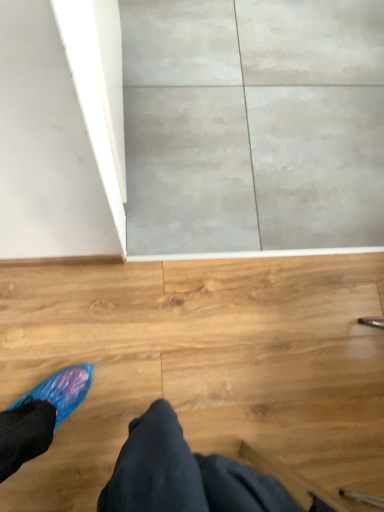
I want to click on blue plastic shoe at lower left, so click(x=191, y=476).

Image resolution: width=384 pixels, height=512 pixels. What do you see at coordinates (191, 476) in the screenshot? I see `blue plastic shoe at lower left` at bounding box center [191, 476].

At what (x,y) coordinates should I click in order to perform the action: click on gray concrete wall at upper center. Please return your answer as a coordinate pair (x, y). The width and height of the screenshot is (384, 512). Looking at the image, I should click on (253, 125).

The height and width of the screenshot is (512, 384). Describe the element at coordinates (253, 125) in the screenshot. I see `gray concrete wall at upper center` at that location.

You are a GUI agent. You are given a task and a screenshot of the screen. Output one action in this format:
    pyautogui.click(x=<x>, y=<y>)
    Task: Click on the blue plastic shoe at lower left
    Image resolution: width=384 pixels, height=512 pixels.
    Given the screenshot: What is the action you would take?
    pyautogui.click(x=191, y=476)

Would you say blue plastic shoe at lower left is to the left or to the right of gray concrete wall at upper center in the picture?

Based on their positions, blue plastic shoe at lower left is located to the left of gray concrete wall at upper center.

Is blue plastic shoe at lower left closer to the viewer compared to gray concrete wall at upper center?

Yes, blue plastic shoe at lower left is closer to the viewer.

Which point is more distant from viewer, (x=7, y=468) or (x=288, y=65)?

The point (x=288, y=65) is behind.

Based on the photo, from the image's perspective, between blue plastic shoe at lower left and gray concrete wall at upper center, which one is located above?

gray concrete wall at upper center, from the image's perspective.

From a real-world perspective, is blue plastic shoe at lower left on top of gray concrete wall at upper center?

Indeed, from a real-world perspective, blue plastic shoe at lower left stands above gray concrete wall at upper center.

Considering the sizes of blue plastic shoe at lower left and gray concrete wall at upper center in the image, is blue plastic shoe at lower left wider or thinner than gray concrete wall at upper center?

blue plastic shoe at lower left is thinner than gray concrete wall at upper center.

Does blue plastic shoe at lower left have a greater height compared to gray concrete wall at upper center?

Correct, blue plastic shoe at lower left is much taller as gray concrete wall at upper center.

Considering the sizes of objects blue plastic shoe at lower left and gray concrete wall at upper center in the image provided, who is bigger, blue plastic shoe at lower left or gray concrete wall at upper center?

Bigger between the two is blue plastic shoe at lower left.

Which is correct: blue plastic shoe at lower left is inside gray concrete wall at upper center, or outside of it?

blue plastic shoe at lower left is spatially situated outside gray concrete wall at upper center.

Consider the image. Would you consider blue plastic shoe at lower left to be distant from gray concrete wall at upper center?

They are positioned close to each other.

Is blue plastic shoe at lower left turned away from gray concrete wall at upper center?

No, blue plastic shoe at lower left's orientation is not away from gray concrete wall at upper center.

This screenshot has height=512, width=384. In order to click on concrete on the right of blue plastic shoe at lower left in this screenshot , I will do `click(253, 125)`.

Does gray concrete wall at upper center appear on the right side of blue plastic shoe at lower left?

Correct, you'll find gray concrete wall at upper center to the right of blue plastic shoe at lower left.

Between gray concrete wall at upper center and blue plastic shoe at lower left, which one is positioned behind?

gray concrete wall at upper center is further from the camera.

Is point (214, 242) less distant than point (167, 425)?

No, it is behind (167, 425).

From the image's perspective, is gray concrete wall at upper center above or below blue plastic shoe at lower left?

Based on their image positions, gray concrete wall at upper center is located above blue plastic shoe at lower left.

Consider the image. From a real-world perspective, is gray concrete wall at upper center located higher than blue plastic shoe at lower left?

Actually, gray concrete wall at upper center is physically below blue plastic shoe at lower left in the real world.

Between gray concrete wall at upper center and blue plastic shoe at lower left, which one has smaller width?

With smaller width is blue plastic shoe at lower left.

Between gray concrete wall at upper center and blue plastic shoe at lower left, which one has less height?

With less height is gray concrete wall at upper center.

Based on their sizes in the image, would you say gray concrete wall at upper center is bigger or smaller than blue plastic shoe at lower left?

In the image, gray concrete wall at upper center appears to be smaller than blue plastic shoe at lower left.

Choose the correct answer: Is gray concrete wall at upper center inside blue plastic shoe at lower left or outside it?

gray concrete wall at upper center is not inside blue plastic shoe at lower left, it's outside.

Can you see gray concrete wall at upper center touching blue plastic shoe at lower left?

There is a gap between gray concrete wall at upper center and blue plastic shoe at lower left.

Is gray concrete wall at upper center positioned with its back to blue plastic shoe at lower left?

That's not correct — gray concrete wall at upper center is not looking away from blue plastic shoe at lower left.

Based on the photo, what's the angular difference between gray concrete wall at upper center and blue plastic shoe at lower left's facing directions?

68.3 degrees separate the facing orientations of gray concrete wall at upper center and blue plastic shoe at lower left.

This screenshot has width=384, height=512. Identify the location of concrete that appears on the right of blue plastic shoe at lower left. (253, 125).

This screenshot has height=512, width=384. In order to click on concrete that appears below the blue plastic shoe at lower left (from a real-world perspective) in this screenshot , I will do `click(253, 125)`.

Where is `concrete lying above the blue plastic shoe at lower left (from the image's perspective)`? concrete lying above the blue plastic shoe at lower left (from the image's perspective) is located at coordinates click(253, 125).